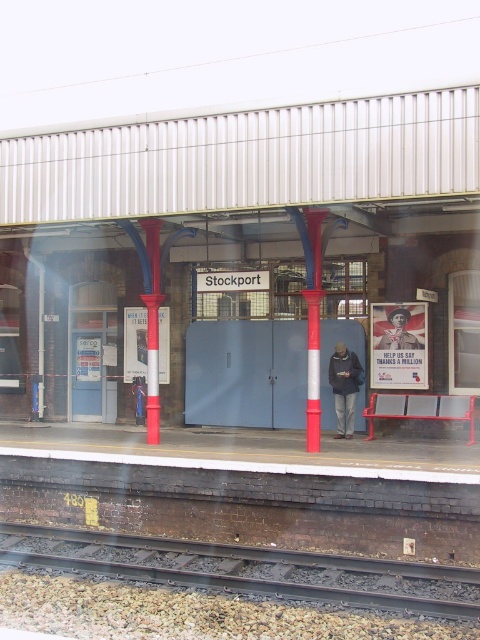
Describe the element at coordinates (250, 570) in the screenshot. I see `smooth metal track at lower center` at that location.

Can you confirm if smooth metal track at lower center is positioned below matte black jacket at center?

Yes, smooth metal track at lower center is below matte black jacket at center.

Is point (40, 529) positioned in front of point (404, 346)?

Yes, it is in front of point (404, 346).

At what (x,y) coordinates should I click in order to perform the action: click on smooth metal track at lower center. Please return your answer as a coordinate pair (x, y). Looking at the image, I should click on (250, 570).

Does dark blue jacket at center have a greater width compared to matte black jacket at center?

No, dark blue jacket at center is not wider than matte black jacket at center.

Can you confirm if dark blue jacket at center is thinner than matte black jacket at center?

Yes.

Which is in front, point (350, 412) or point (414, 339)?

Point (350, 412)

Find the location of a particular element. dark blue jacket at center is located at coordinates (345, 387).

Is smooth metal track at lower center thinner than dark blue jacket at center?

No, smooth metal track at lower center is not thinner than dark blue jacket at center.

You are a GUI agent. You are given a task and a screenshot of the screen. Output one action in this format:
    pyautogui.click(x=<x>, y=<y>)
    Task: Click on the smooth metal track at lower center
    
    Given the screenshot: What is the action you would take?
    pyautogui.click(x=250, y=570)

Between point (312, 566) and point (331, 371), which one is positioned in front?

Point (312, 566) is more forward.

Identify the location of smooth metal track at lower center. (250, 570).